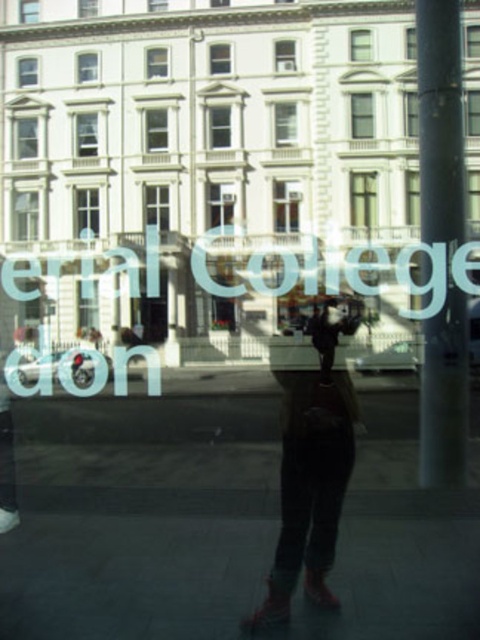
Question: Does smooth concrete pavement at lower center have a lesser width compared to matte black boots at center?

Choices:
 (A) no
 (B) yes

Answer: (B)

Question: Which of these objects is positioned farthest from the smooth metallic pole at right?

Choices:
 (A) smooth concrete pavement at lower center
 (B) matte black boots at center

Answer: (B)

Question: Is smooth concrete pavement at lower center wider than smooth metallic pole at right?

Choices:
 (A) yes
 (B) no

Answer: (A)

Question: Is smooth concrete pavement at lower center wider than matte black boots at center?

Choices:
 (A) yes
 (B) no

Answer: (B)

Question: Which point is farther from the camera taking this photo?

Choices:
 (A) (436, 115)
 (B) (307, 435)
 (C) (90, 605)

Answer: (B)

Question: Which point is farther from the camera taking this photo?

Choices:
 (A) (395, 518)
 (B) (437, 474)
 (C) (316, 576)

Answer: (B)